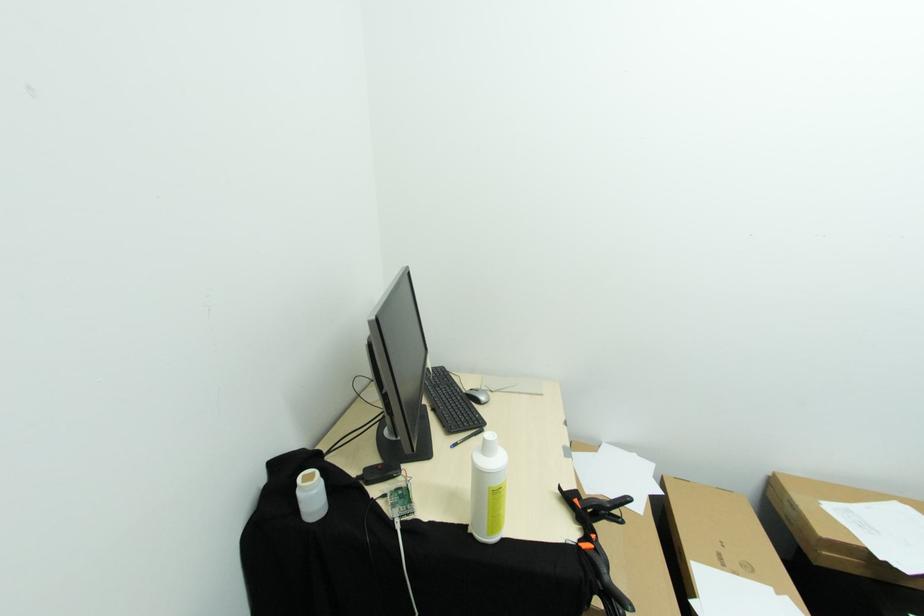
Describe the element at coordinates (454, 408) in the screenshot. The image size is (924, 616). I see `the keyboard keys` at that location.